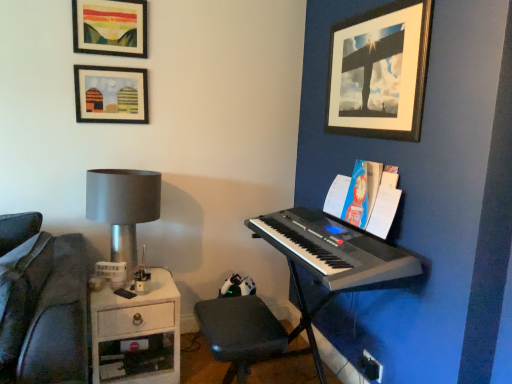
The height and width of the screenshot is (384, 512). Describe the element at coordinates (111, 94) in the screenshot. I see `matte black picture frame at upper left, which is the third picture frame from right to left` at that location.

Measure the distance between point (260,235) and camera.

The depth of point (260,235) is 2.17 meters.

This screenshot has width=512, height=384. I want to click on black plastic keyboard at right, so click(x=333, y=249).

Measure the distance between point [253,357] and camera.

A distance of 1.67 meters exists between point [253,357] and camera.

Describe the element at coordinates (334, 259) in the screenshot. I see `silver metallic keyboard at right` at that location.

Identify the location of white glossy drawer at lower left. (137, 334).

In order to face matte silver lamp at left, should I rotate leftwards or rightwards?

To face it directly, rotate left by 17.175 degrees.

This screenshot has height=384, width=512. What do you see at coordinates (365, 198) in the screenshot? I see `blue paper at right` at bounding box center [365, 198].

You are a GUI agent. You are given a task and a screenshot of the screen. Output one action in this format:
    pyautogui.click(x=<x>, y=<y>)
    Task: Click on the matte glass picture frame at upper left, placed as the second picture frame when sorted from right to left
    The image size is (512, 384).
    Given the screenshot: What is the action you would take?
    pyautogui.click(x=110, y=27)

In the image, there is a white glossy drawer at lower left. Where is `paperback book above it (from the image's perspective)`? This screenshot has width=512, height=384. paperback book above it (from the image's perspective) is located at coordinates (365, 198).

Considering the positions of points (175, 354) and (349, 216), is point (175, 354) closer to camera compared to point (349, 216)?

No, (175, 354) is behind (349, 216).

Which is more to the right, white glossy drawer at lower left or blue paper at right?

blue paper at right is more to the right.

Could you tell me if white glossy drawer at lower left is facing blue paper at right?

No, white glossy drawer at lower left is not oriented towards blue paper at right.

Which is behind, silver metallic keyboard at right or matte glass picture frame at upper left, acting as the second picture frame starting from the left?

Positioned behind is matte glass picture frame at upper left, acting as the second picture frame starting from the left.

In the scene shown: Based on their sizes in the image, would you say silver metallic keyboard at right is bigger or smaller than matte glass picture frame at upper left, placed as the second picture frame when sorted from right to left?

silver metallic keyboard at right is bigger than matte glass picture frame at upper left, placed as the second picture frame when sorted from right to left.

This screenshot has height=384, width=512. Find the location of `piano below the matte glass picture frame at upper left, placed as the second picture frame when sorted from right to left (from the image's perspective)`. piano below the matte glass picture frame at upper left, placed as the second picture frame when sorted from right to left (from the image's perspective) is located at coordinates (334, 259).

From a real-world perspective, is silver metallic keyboard at right positioned under matte glass picture frame at upper left, placed as the second picture frame when sorted from right to left, based on gravity?

Indeed, from a real-world perspective, silver metallic keyboard at right is positioned beneath matte glass picture frame at upper left, placed as the second picture frame when sorted from right to left.

Is black matte step stool at lower center oriented away from white glossy drawer at lower left?

No, black matte step stool at lower center's orientation is not away from white glossy drawer at lower left.

Does black matte step stool at lower center have a larger size compared to white glossy drawer at lower left?

Actually, black matte step stool at lower center might be smaller than white glossy drawer at lower left.

Which object is more forward, black matte step stool at lower center or white glossy drawer at lower left?

black matte step stool at lower center is more forward.

Does black matte step stool at lower center appear on the right side of white glossy drawer at lower left?

Correct, you'll find black matte step stool at lower center to the right of white glossy drawer at lower left.

Which object is wider, white glossy drawer at lower left or matte silver lamp at left?

Wider between the two is white glossy drawer at lower left.

What are the coordinates of `table lamp that is above the white glossy drawer at lower left (from a real-world perspective)` in the screenshot? It's located at (123, 207).

Does white glossy drawer at lower left touch matte silver lamp at left?

white glossy drawer at lower left is not next to matte silver lamp at left, and they're not touching.

Is white glossy drawer at lower left taller or shorter than matte silver lamp at left?

In the image, white glossy drawer at lower left appears to be shorter than matte silver lamp at left.

Is the depth of silver metallic keyboard at right greater than that of blue paper at right?

No.

Is silver metallic keyboard at right oriented towards blue paper at right?

No.

Considering the relative positions of silver metallic keyboard at right and blue paper at right in the image provided, is silver metallic keyboard at right to the left of blue paper at right from the viewer's perspective?

Yes.

How far apart are silver metallic keyboard at right and blue paper at right?

The distance of silver metallic keyboard at right from blue paper at right is 19.50 centimeters.

Considering the relative positions of black plastic keyboard at right and black matte step stool at lower center in the image provided, is black plastic keyboard at right to the right of black matte step stool at lower center from the viewer's perspective?

Yes.

You are a GUI agent. You are given a task and a screenshot of the screen. Output one action in this format:
    pyautogui.click(x=<x>, y=<y>)
    Task: Click on the step stool behind the black plastic keyboard at right
    Image resolution: width=512 pixels, height=384 pixels.
    Given the screenshot: What is the action you would take?
    pyautogui.click(x=240, y=333)

Considering the relative sizes of black plastic keyboard at right and black matte step stool at lower center in the image provided, is black plastic keyboard at right thinner than black matte step stool at lower center?

Incorrect, the width of black plastic keyboard at right is not less than that of black matte step stool at lower center.

Based on the photo, from a real-world perspective, which is physically below, black plastic keyboard at right or black matte step stool at lower center?

From a 3D spatial view, black matte step stool at lower center is below.

Measure the distance between matte black picture frame at upper left, which is the third picture frame from right to left, and blue paper at right.

matte black picture frame at upper left, which is the third picture frame from right to left, and blue paper at right are 4.26 feet apart from each other.

Is matte black picture frame at upper left, which is the third picture frame from right to left, taller than blue paper at right?

In fact, matte black picture frame at upper left, which is the third picture frame from right to left, may be shorter than blue paper at right.

From a real-world perspective, is matte black picture frame at upper left, which appears as the 1th picture frame when viewed from the left, located beneath blue paper at right?

No, from a real-world perspective, matte black picture frame at upper left, which appears as the 1th picture frame when viewed from the left, is not below blue paper at right.

Is matte black picture frame at upper left, which appears as the 1th picture frame when viewed from the left, positioned behind blue paper at right?

Yes, the depth of matte black picture frame at upper left, which appears as the 1th picture frame when viewed from the left, is greater than that of blue paper at right.

You are a GUI agent. You are given a task and a screenshot of the screen. Output one action in this format:
    pyautogui.click(x=<x>, y=<y>)
    Task: Click on the table directly beneath the blue paper at right (from a real-world perspective)
    This screenshot has width=512, height=384.
    Given the screenshot: What is the action you would take?
    pyautogui.click(x=137, y=334)

Where is `the 3rd picture frame above when counting from the silver metallic keyboard at right (from the image's perspective)`? This screenshot has height=384, width=512. the 3rd picture frame above when counting from the silver metallic keyboard at right (from the image's perspective) is located at coordinates (110, 27).

Estimate the real-world distances between objects in this image. Which object is further from wooden picture frame at upper right, which is the third picture frame in left-to-right order, black plastic keyboard at right or matte glass picture frame at upper left, placed as the second picture frame when sorted from right to left?

Among the two, matte glass picture frame at upper left, placed as the second picture frame when sorted from right to left, is located further to wooden picture frame at upper right, which is the third picture frame in left-to-right order.

Based on the photo, considering their positions, is white glossy drawer at lower left positioned further to wooden picture frame at upper right, which is counted as the 1th picture frame, starting from the right, than black matte step stool at lower center?

white glossy drawer at lower left is further to wooden picture frame at upper right, which is counted as the 1th picture frame, starting from the right.

Estimate the real-world distances between objects in this image. Which object is further from black matte step stool at lower center, matte black picture frame at upper left, which is the third picture frame from right to left, or silver metallic keyboard at right?

matte black picture frame at upper left, which is the third picture frame from right to left, is positioned further to the anchor black matte step stool at lower center.

Which object lies further to the anchor point blue paper at right, white glossy drawer at lower left or matte glass picture frame at upper left, placed as the second picture frame when sorted from right to left?

Among the two, matte glass picture frame at upper left, placed as the second picture frame when sorted from right to left, is located further to blue paper at right.

Estimate the real-world distances between objects in this image. Which object is further from black matte step stool at lower center, matte black picture frame at upper left, which is the third picture frame from right to left, or blue paper at right?

matte black picture frame at upper left, which is the third picture frame from right to left, lies further to black matte step stool at lower center than the other object.

Looking at the image, which one is located closer to matte glass picture frame at upper left, placed as the second picture frame when sorted from right to left, silver metallic keyboard at right or matte black picture frame at upper left, which appears as the 1th picture frame when viewed from the left?

matte black picture frame at upper left, which appears as the 1th picture frame when viewed from the left, is positioned closer to the anchor matte glass picture frame at upper left, placed as the second picture frame when sorted from right to left.

From the image, which object appears to be farther from black matte step stool at lower center, silver metallic keyboard at right or matte black picture frame at upper left, which is the third picture frame from right to left?

matte black picture frame at upper left, which is the third picture frame from right to left.

Which object lies further to the anchor point matte glass picture frame at upper left, placed as the second picture frame when sorted from right to left, matte silver lamp at left or black matte step stool at lower center?

The object further to matte glass picture frame at upper left, placed as the second picture frame when sorted from right to left, is black matte step stool at lower center.

I want to click on step stool located between matte silver lamp at left and blue paper at right in the left-right direction, so click(240, 333).

Image resolution: width=512 pixels, height=384 pixels. Identify the location of table between matte black picture frame at upper left, which appears as the 1th picture frame when viewed from the left, and wooden picture frame at upper right, which is the third picture frame in left-to-right order, from left to right. [x=137, y=334].

Identify the location of musical keyboard between matte black picture frame at upper left, which appears as the 1th picture frame when viewed from the left, and black matte step stool at lower center, in the vertical direction. The width and height of the screenshot is (512, 384). (333, 249).

Image resolution: width=512 pixels, height=384 pixels. I want to click on musical keyboard that lies between matte glass picture frame at upper left, placed as the second picture frame when sorted from right to left, and black matte step stool at lower center from top to bottom, so click(333, 249).